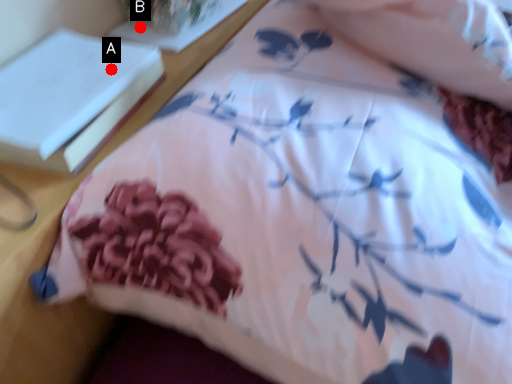
Question: Two points are circled on the image, labeled by A and B beside each circle. Which point is closer to the camera?

Choices:
 (A) A is closer
 (B) B is closer

Answer: (A)